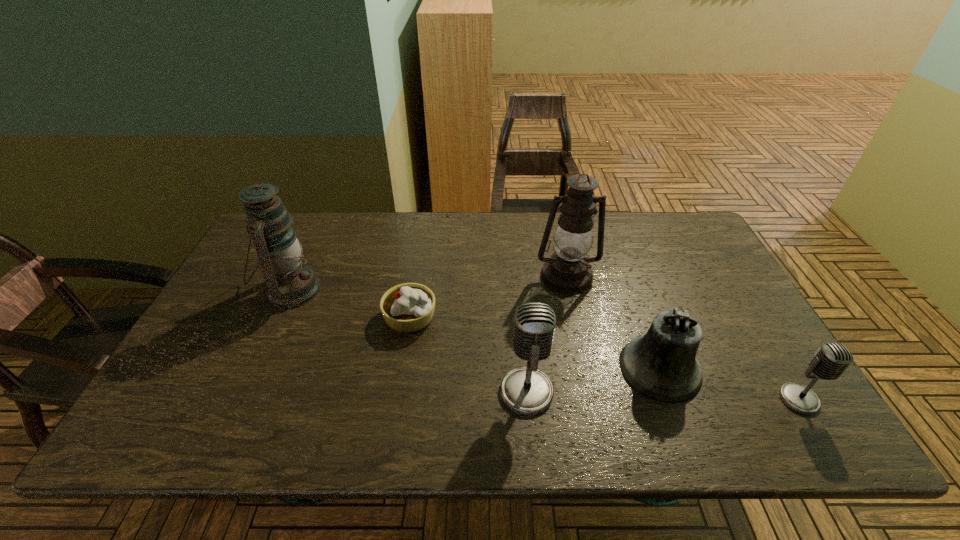
At what (x,y) coordinates should I click in order to perform the action: click on the left microphone. Please return your answer as a coordinate pair (x, y). Looking at the image, I should click on 528,391.

Find the location of a particular element. Image resolution: width=960 pixels, height=540 pixels. the third tallest object is located at coordinates (528, 391).

This screenshot has width=960, height=540. I want to click on the rightmost object, so click(x=831, y=359).

Where is `the shorter microphone`? the shorter microphone is located at coordinates (831, 359).

This screenshot has width=960, height=540. Find the location of `the leftmost object`. the leftmost object is located at coordinates (290, 283).

Find the location of a particular element. This screenshot has height=540, width=960. the right oil lamp is located at coordinates (567, 270).

Where is `whipped cream`? The height and width of the screenshot is (540, 960). whipped cream is located at coordinates (408, 307).

You are a GUI agent. You are given a task and a screenshot of the screen. Output one action in this format:
    pyautogui.click(x=<x>, y=<y>)
    Task: Click on the second object from left to right
    
    Given the screenshot: What is the action you would take?
    pyautogui.click(x=408, y=307)

Find the location of `bell`. bell is located at coordinates (662, 365).

I want to click on free space located on the right of the left microphone, so click(x=623, y=392).